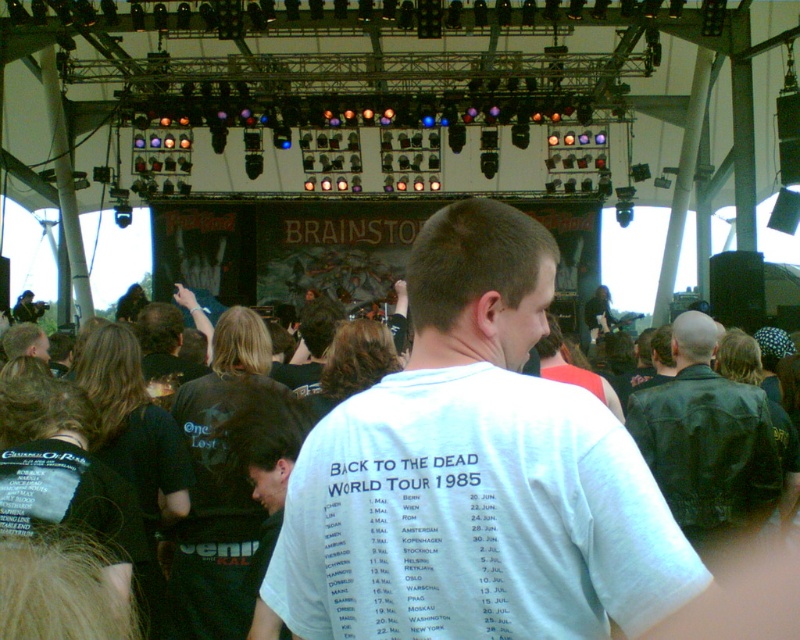
You are a stagehand at the BRAINSTORM concert. You need to place a small decorative item on the stage. The item requires a flat surface. Which jacket, the black leather jacket at right or the dark brown leather jacket at center, has a larger surface area to place the item?

The black leather jacket at right is larger in size than the dark brown leather jacket at center, so the black leather jacket at right has a larger surface area to place the item.